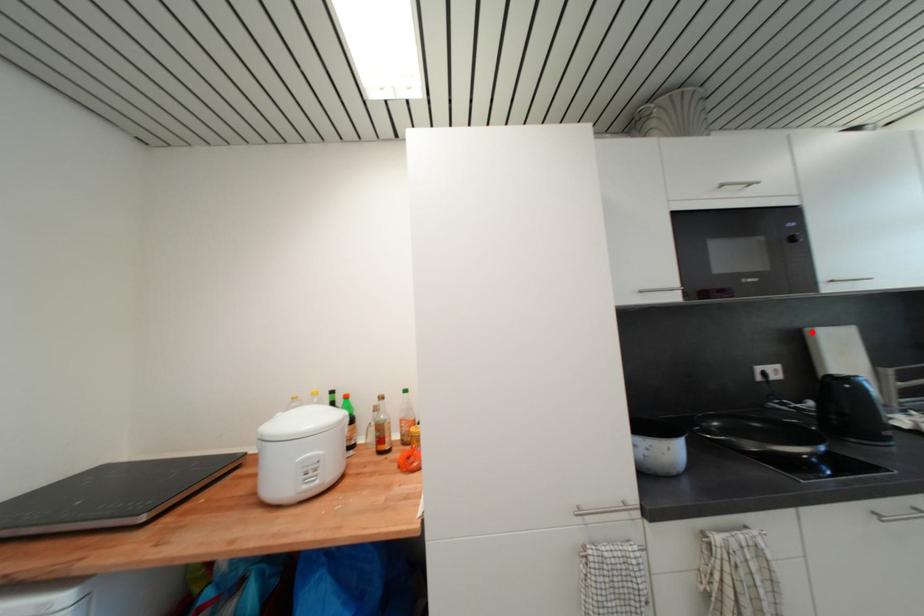
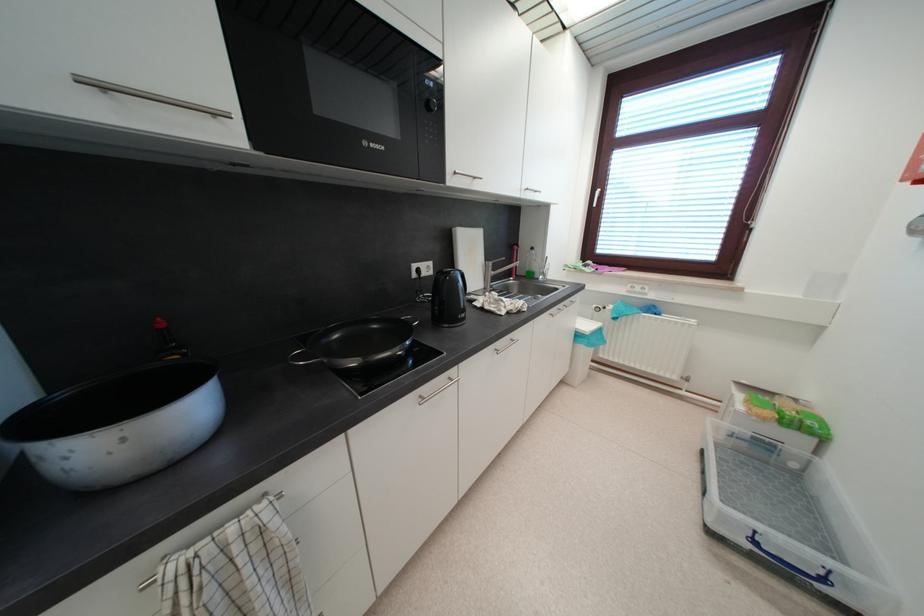
Where in the second image is the point corresponding to the highlighted location from the first image?

(458, 232)